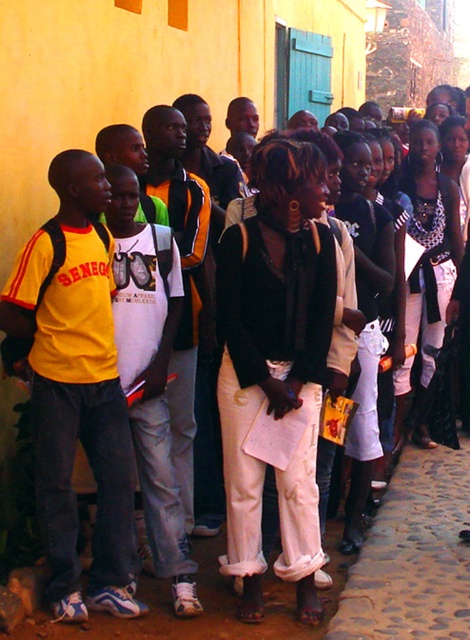
Question: Can you confirm if matte black sweater at center is bigger than yellow matte shirt at left?

Choices:
 (A) no
 (B) yes

Answer: (B)

Question: Which object is farther from the camera taking this photo?

Choices:
 (A) yellow matte shirt at left
 (B) matte black sweater at center

Answer: (B)

Question: Does matte black sweater at center have a lesser width compared to yellow matte shirt at left?

Choices:
 (A) no
 (B) yes

Answer: (B)

Question: Is matte black sweater at center positioned before yellow matte shirt at left?

Choices:
 (A) yes
 (B) no

Answer: (B)